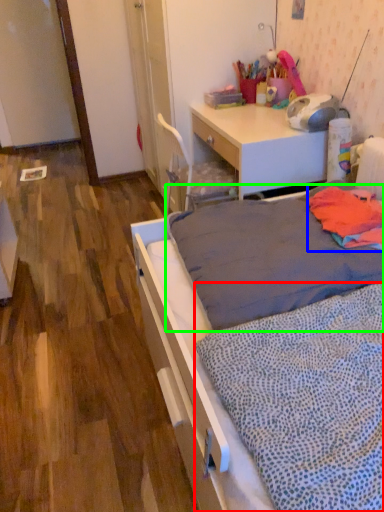
Question: Which is farther away from blanket (highlighted by a red box)? blanket (highlighted by a blue box) or mattress (highlighted by a green box)?

Choices:
 (A) blanket
 (B) mattress

Answer: (A)